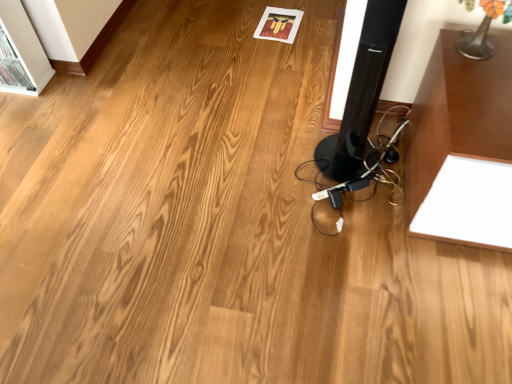
What do you see at coordinates (484, 30) in the screenshot?
I see `metallic silver table lamp at upper right` at bounding box center [484, 30].

Where is `metallic silver table lamp at upper right`? metallic silver table lamp at upper right is located at coordinates (484, 30).

Where is `black glossy speaker at center`? The height and width of the screenshot is (384, 512). black glossy speaker at center is located at coordinates (362, 92).

The width and height of the screenshot is (512, 384). Describe the element at coordinates (362, 92) in the screenshot. I see `black glossy speaker at center` at that location.

The height and width of the screenshot is (384, 512). In order to click on metallic silver table lamp at upper right in this screenshot , I will do `click(484, 30)`.

Which is more to the left, black glossy speaker at center or metallic silver table lamp at upper right?

black glossy speaker at center.

Which object is further away from the camera taking this photo, black glossy speaker at center or metallic silver table lamp at upper right?

metallic silver table lamp at upper right is more distant.

In the scene shown: Which point is more forward, (345, 141) or (489, 47)?

Positioned in front is point (489, 47).

From the image's perspective, is black glossy speaker at center located beneath metallic silver table lamp at upper right?

Yes, from the image's perspective, black glossy speaker at center is below metallic silver table lamp at upper right.

From a real-world perspective, who is located lower, black glossy speaker at center or metallic silver table lamp at upper right?

From a 3D spatial view, black glossy speaker at center is below.

Considering the relative sizes of black glossy speaker at center and metallic silver table lamp at upper right in the image provided, is black glossy speaker at center wider than metallic silver table lamp at upper right?

Yes, black glossy speaker at center is wider than metallic silver table lamp at upper right.

Which of these two, black glossy speaker at center or metallic silver table lamp at upper right, stands taller?

black glossy speaker at center.

Between black glossy speaker at center and metallic silver table lamp at upper right, which one has larger size?

black glossy speaker at center is bigger.

Is black glossy speaker at center inside or outside of metallic silver table lamp at upper right?

black glossy speaker at center is not inside metallic silver table lamp at upper right, it's outside.

Are black glossy speaker at center and metallic silver table lamp at upper right far apart?

No, there isn't a large distance between black glossy speaker at center and metallic silver table lamp at upper right.

Is black glossy speaker at center oriented towards metallic silver table lamp at upper right?

No, black glossy speaker at center does not turn towards metallic silver table lamp at upper right.

How different are the orientations of black glossy speaker at center and metallic silver table lamp at upper right in degrees?

There is a 7.55-degree angle between the facing directions of black glossy speaker at center and metallic silver table lamp at upper right.

The width and height of the screenshot is (512, 384). In order to click on speaker that is below the metallic silver table lamp at upper right (from the image's perspective) in this screenshot , I will do `click(362, 92)`.

Would you say metallic silver table lamp at upper right is to the left or to the right of black glossy speaker at center in the picture?

From the image, it's evident that metallic silver table lamp at upper right is to the right of black glossy speaker at center.

Which object is closer to the camera, metallic silver table lamp at upper right or black glossy speaker at center?

black glossy speaker at center is more forward.

Is point (472, 44) closer or farther from the camera than point (364, 134)?

Point (472, 44) appears to be closer to the viewer than point (364, 134).

From the image's perspective, which one is positioned lower, metallic silver table lamp at upper right or black glossy speaker at center?

From the image's view, black glossy speaker at center is below.

From a real-world perspective, is metallic silver table lamp at upper right above or below black glossy speaker at center?

From a real-world perspective, metallic silver table lamp at upper right is physically above black glossy speaker at center.

Between metallic silver table lamp at upper right and black glossy speaker at center, which one has smaller width?

metallic silver table lamp at upper right is thinner.

Considering the sizes of objects metallic silver table lamp at upper right and black glossy speaker at center in the image provided, who is taller, metallic silver table lamp at upper right or black glossy speaker at center?

With more height is black glossy speaker at center.

Considering the sizes of objects metallic silver table lamp at upper right and black glossy speaker at center in the image provided, who is bigger, metallic silver table lamp at upper right or black glossy speaker at center?

With larger size is black glossy speaker at center.

Is black glossy speaker at center located within metallic silver table lamp at upper right?

No.

Is there a large distance between metallic silver table lamp at upper right and black glossy speaker at center?

metallic silver table lamp at upper right is actually quite close to black glossy speaker at center.

Could you tell me if metallic silver table lamp at upper right is turned towards black glossy speaker at center?

No, metallic silver table lamp at upper right is not aimed at black glossy speaker at center.

How different are the orientations of metallic silver table lamp at upper right and black glossy speaker at center in degrees?

7.55 degrees separate the facing orientations of metallic silver table lamp at upper right and black glossy speaker at center.

Where is `table lamp behind the black glossy speaker at center`? Image resolution: width=512 pixels, height=384 pixels. table lamp behind the black glossy speaker at center is located at coordinates (484, 30).

You are a GUI agent. You are given a task and a screenshot of the screen. Output one action in this format:
    pyautogui.click(x=<x>, y=<y>)
    Task: Click on the speaker below the metallic silver table lamp at upper right (from the image's perspective)
    Image resolution: width=512 pixels, height=384 pixels.
    Given the screenshot: What is the action you would take?
    pyautogui.click(x=362, y=92)

Locate an element on the screen. This screenshot has width=512, height=384. table lamp on the right of black glossy speaker at center is located at coordinates (484, 30).